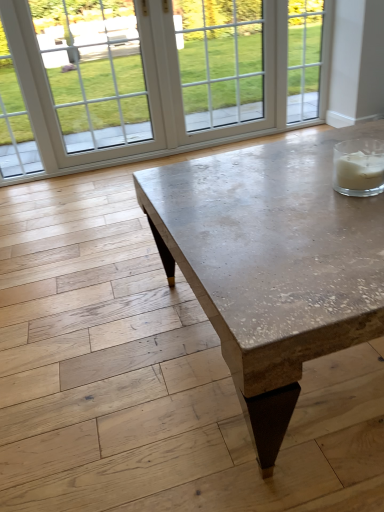
This screenshot has height=512, width=384. What do you see at coordinates (272, 264) in the screenshot?
I see `matte concrete coffee table at center` at bounding box center [272, 264].

I want to click on matte concrete coffee table at center, so click(272, 264).

I want to click on white glass window at upper left, so click(14, 120).

The image size is (384, 512). What do you see at coordinates (14, 120) in the screenshot?
I see `white glass window at upper left` at bounding box center [14, 120].

Identify the location of matte concrete coffee table at center. (272, 264).

Between matte concrete coffee table at center and white glass window at upper left, which one appears on the left side from the viewer's perspective?

Positioned to the left is white glass window at upper left.

Does matte concrete coffee table at center lie in front of white glass window at upper left?

Yes, the depth of matte concrete coffee table at center is less than that of white glass window at upper left.

Does point (295, 219) appear closer or farther from the camera than point (22, 100)?

Point (295, 219) is closer to the camera than point (22, 100).

From the image's perspective, does matte concrete coffee table at center appear higher than white glass window at upper left?

Incorrect, from the image's perspective, matte concrete coffee table at center is lower than white glass window at upper left.

From a real-world perspective, is matte concrete coffee table at center on white glass window at upper left?

No, from a real-world perspective, matte concrete coffee table at center is not above white glass window at upper left.

Can you confirm if matte concrete coffee table at center is wider than white glass window at upper left?

Correct, the width of matte concrete coffee table at center exceeds that of white glass window at upper left.

Is matte concrete coffee table at center shorter than white glass window at upper left?

Indeed, matte concrete coffee table at center has a lesser height compared to white glass window at upper left.

Which of these two, matte concrete coffee table at center or white glass window at upper left, is smaller?

Smaller between the two is white glass window at upper left.

Would you say matte concrete coffee table at center is inside or outside white glass window at upper left?

matte concrete coffee table at center exists outside the volume of white glass window at upper left.

Is matte concrete coffee table at center far away from white glass window at upper left?

Absolutely, matte concrete coffee table at center is distant from white glass window at upper left.

Is matte concrete coffee table at center turned away from white glass window at upper left?

Yes, matte concrete coffee table at center's orientation is away from white glass window at upper left.

Locate an element on the screen. The height and width of the screenshot is (512, 384). coffee table below the white glass window at upper left (from a real-world perspective) is located at coordinates (272, 264).

Between white glass window at upper left and matte concrete coffee table at center, which one appears on the right side from the viewer's perspective?

matte concrete coffee table at center is more to the right.

Is white glass window at upper left positioned behind matte concrete coffee table at center?

That is True.

Does point (12, 151) appear closer or farther from the camera than point (175, 228)?

Point (12, 151) is positioned farther from the camera compared to point (175, 228).

From the image's perspective, is white glass window at upper left above or below matte concrete coffee table at center?

white glass window at upper left is above matte concrete coffee table at center.

From a real-world perspective, is white glass window at upper left under matte concrete coffee table at center?

No, from a real-world perspective, white glass window at upper left is not beneath matte concrete coffee table at center.

Is white glass window at upper left wider or thinner than matte concrete coffee table at center?

In the image, white glass window at upper left appears to be more narrow than matte concrete coffee table at center.

Considering the sizes of white glass window at upper left and matte concrete coffee table at center in the image, is white glass window at upper left taller or shorter than matte concrete coffee table at center?

Considering their sizes, white glass window at upper left has more height than matte concrete coffee table at center.

Looking at the image, does white glass window at upper left seem bigger or smaller compared to matte concrete coffee table at center?

In the image, white glass window at upper left appears to be smaller than matte concrete coffee table at center.

Is white glass window at upper left inside or outside of matte concrete coffee table at center?

white glass window at upper left exists outside the volume of matte concrete coffee table at center.

Is white glass window at upper left in contact with matte concrete coffee table at center?

They are not placed beside each other.

Is white glass window at upper left facing towards matte concrete coffee table at center?

No, white glass window at upper left is not turned towards matte concrete coffee table at center.

What's the angular difference between white glass window at upper left and matte concrete coffee table at center's facing directions?

They differ by 1.22 degrees in their facing directions.

Measure the distance between white glass window at upper left and matte concrete coffee table at center.

white glass window at upper left is 1.91 meters away from matte concrete coffee table at center.

This screenshot has height=512, width=384. In order to click on coffee table lying on the right of white glass window at upper left in this screenshot , I will do `click(272, 264)`.

The height and width of the screenshot is (512, 384). I want to click on coffee table that appears on the right of white glass window at upper left, so click(272, 264).

This screenshot has width=384, height=512. I want to click on window above the matte concrete coffee table at center (from the image's perspective), so click(14, 120).